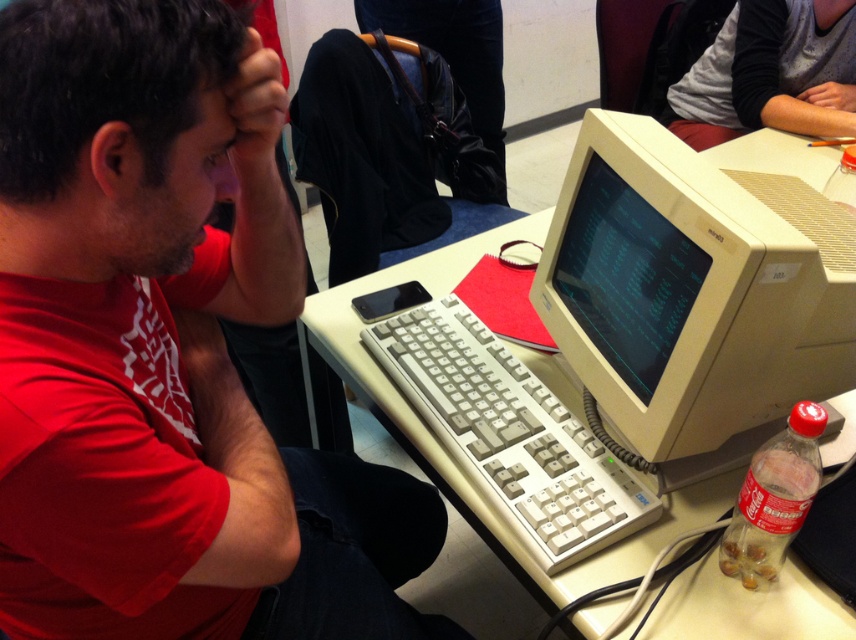
Can you confirm if white plastic table at center is positioned to the right of gray fabric shirt at upper right?

In fact, white plastic table at center is to the left of gray fabric shirt at upper right.

Where is `white plastic table at center`? white plastic table at center is located at coordinates click(x=450, y=456).

In the scene shown: Is matte red shirt at left above gray fabric shirt at upper right?

No, matte red shirt at left is not above gray fabric shirt at upper right.

Does matte red shirt at left appear under gray fabric shirt at upper right?

Yes.

Between point (138, 292) and point (750, 108), which one is positioned behind?

Positioned behind is point (750, 108).

The width and height of the screenshot is (856, 640). Find the location of `matte red shirt at left`. matte red shirt at left is located at coordinates (165, 353).

Does matte red shirt at left have a larger size compared to beige plastic monitor at center?

Indeed, matte red shirt at left has a larger size compared to beige plastic monitor at center.

Does matte red shirt at left come in front of beige plastic monitor at center?

Yes, it is in front of beige plastic monitor at center.

Between point (78, 552) and point (712, 465), which one is positioned in front?

Point (78, 552) is more forward.

Locate an element on the screen. The image size is (856, 640). matte red shirt at left is located at coordinates (165, 353).